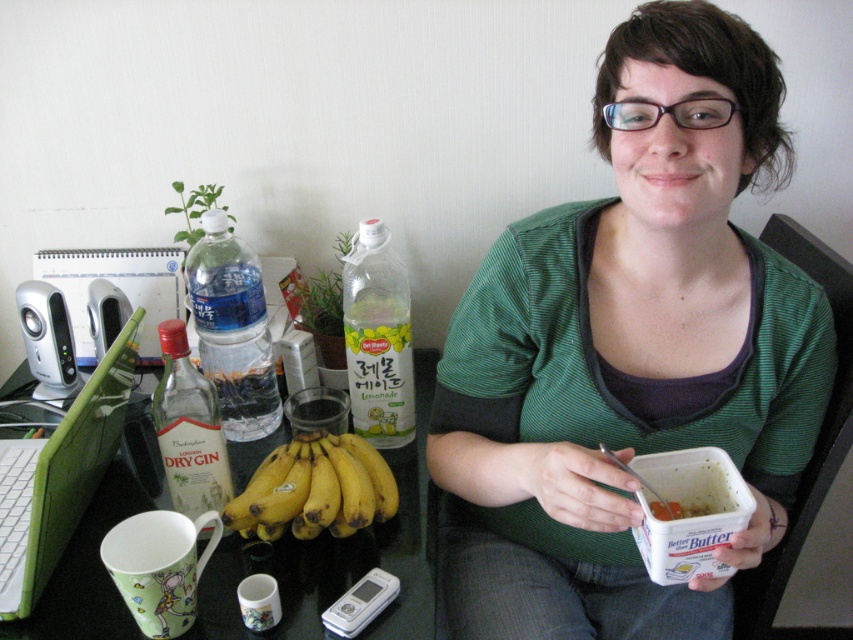
You are organizing a small party and need to choose between the clear plastic bottle at left and the green fabric chair at upper right for a centerpiece. Which item is smaller and better suited for the table?

The clear plastic bottle at left is smaller than the green fabric chair at upper right, making it better suited for the table centerpiece.

You are a fashion designer analyzing the image. You need to determine the exact location of the green striped shirt at center in the image. What are its coordinates?

The green striped shirt at center is located at coordinates point [630,349].